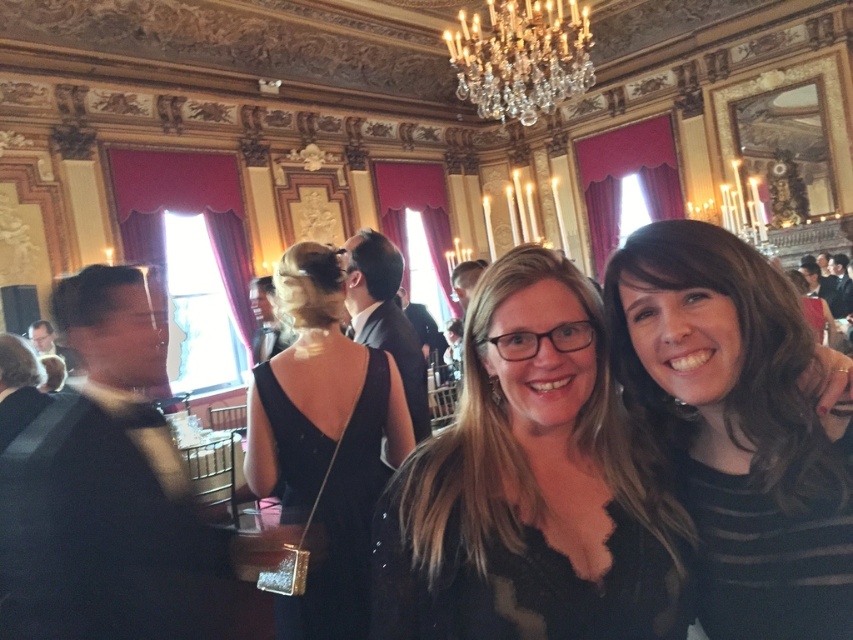
You are a photographer setting up for a group photo. You have to decide where to place a narrow tripod that is 10 cm wide. The black striped shirt at right and the black velvet dress at center are in the frame. Can the tripod fit between them without blocking either?

The black striped shirt at right is thinner than the black velvet dress at center, so there might be enough space between them for the tripod. However, since the exact distance isn not provided, it depends on how close they are positioned. If the space between them is at least 10 cm, the tripod can fit.

Please describe the location of the point labeled as point (x=529, y=484) in the image. What object is located at that point?

The point labeled as point (x=529, y=484) corresponds to the matte black dress at center.